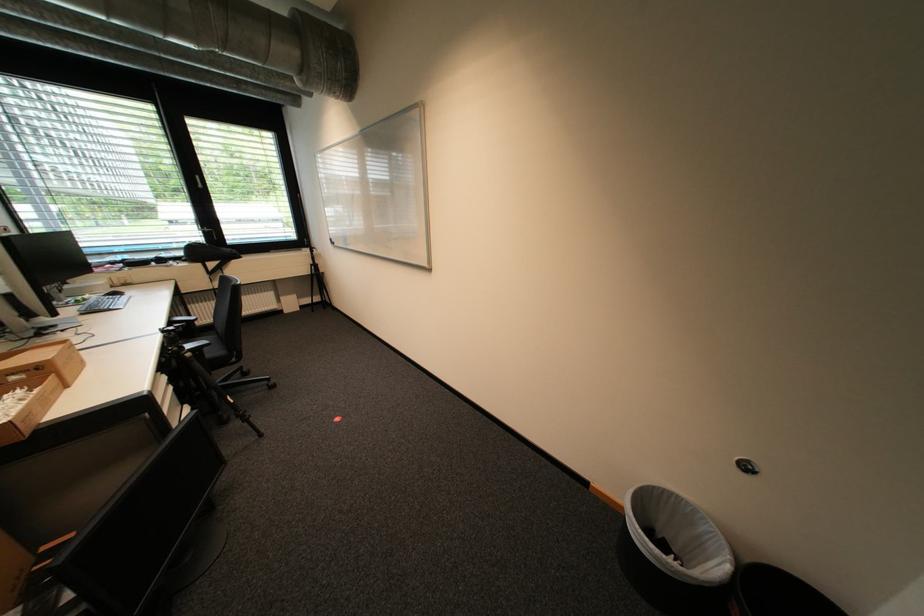
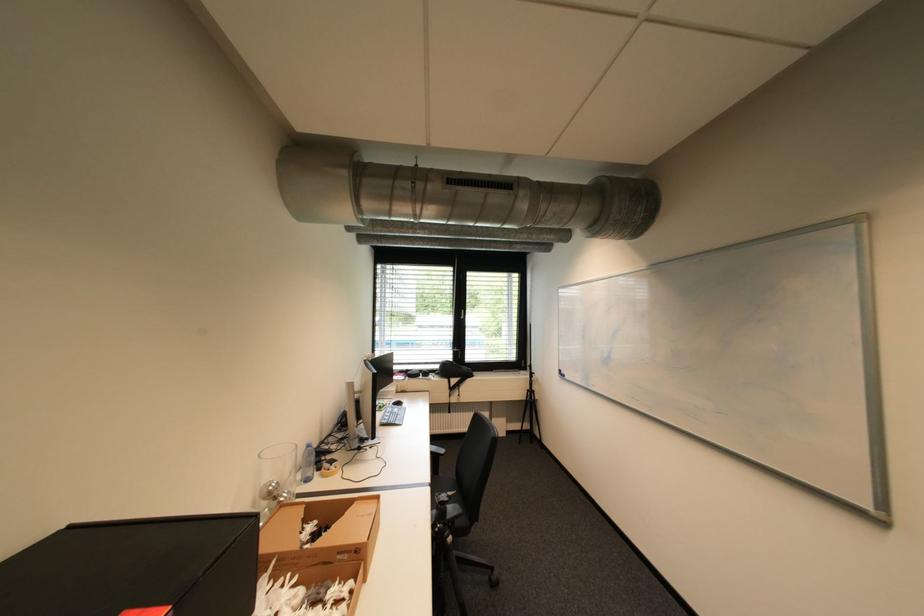
Find the pixel in the second image that matches pixel 319 274 in the first image.

(532, 400)